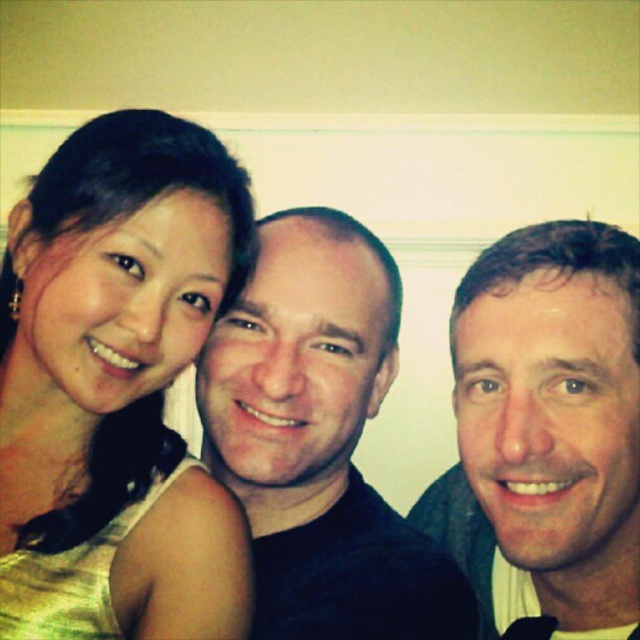
Question: Does matte gold dress at left have a smaller size compared to smooth skin face at right?

Choices:
 (A) yes
 (B) no

Answer: (A)

Question: Which point is closer to the camera?

Choices:
 (A) (272, 280)
 (B) (177, 349)
 (C) (628, 403)

Answer: (C)

Question: Estimate the real-world distances between objects in this image. Which object is farther from the matte black shirt at center?

Choices:
 (A) matte gold dress at left
 (B) smooth skin face at right

Answer: (B)

Question: Does matte gold dress at left appear on the right side of matte black shirt at center?

Choices:
 (A) no
 (B) yes

Answer: (A)

Question: Can you confirm if matte gold dress at left is bigger than matte black shirt at center?

Choices:
 (A) yes
 (B) no

Answer: (B)

Question: Which point is farther from the camera taking this photo?

Choices:
 (A) (403, 598)
 (B) (490, 632)
 (C) (42, 483)

Answer: (B)